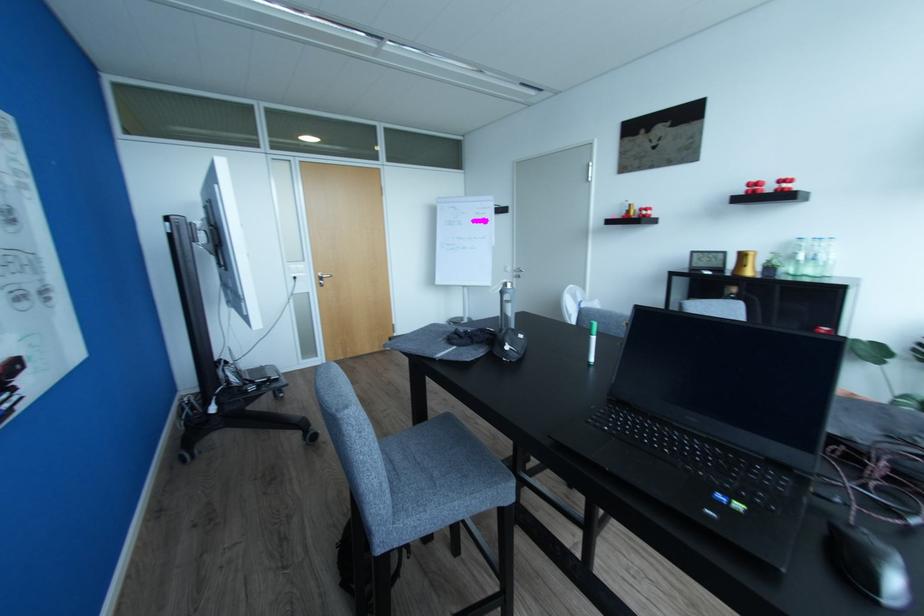
Which object does [506,305] point to?

It refers to a silver water bottle.